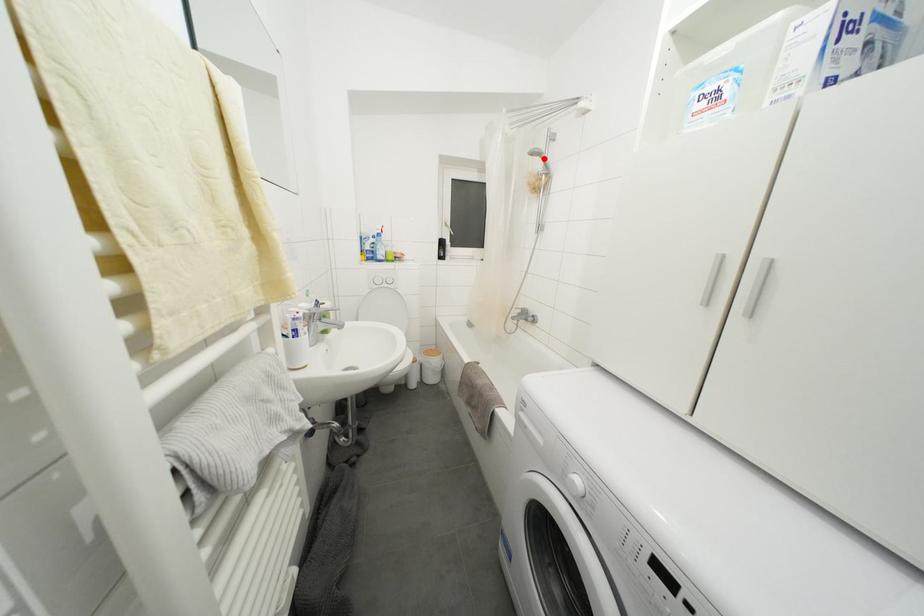
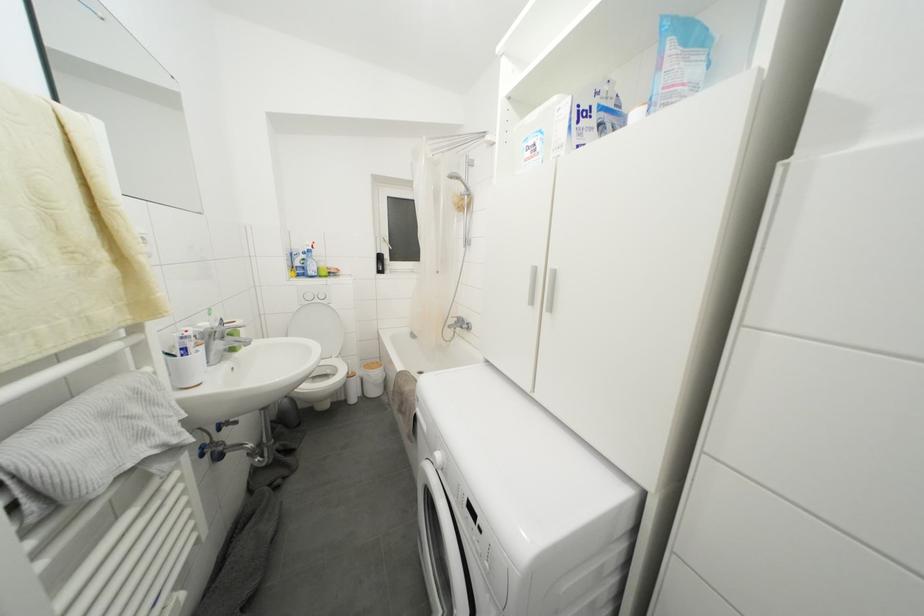
Find the pixel in the second image that matches the highlighted location in the first image.

(463, 182)